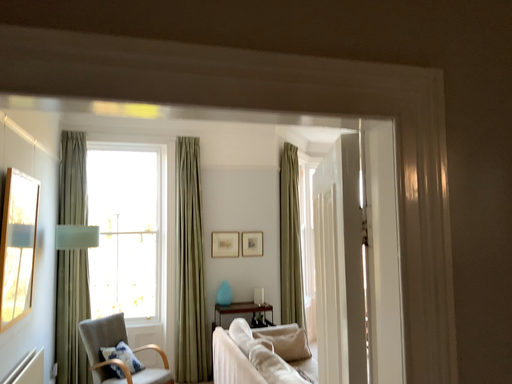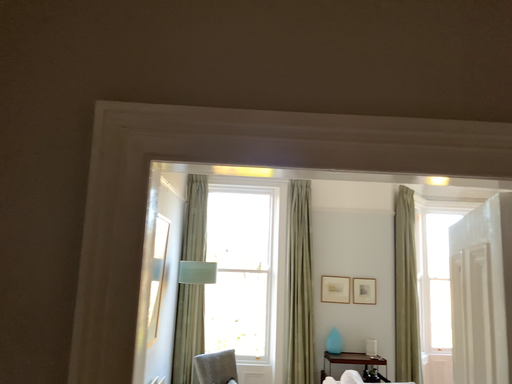
Question: How did the camera likely rotate when shooting the video?

Choices:
 (A) rotated left
 (B) rotated right

Answer: (A)